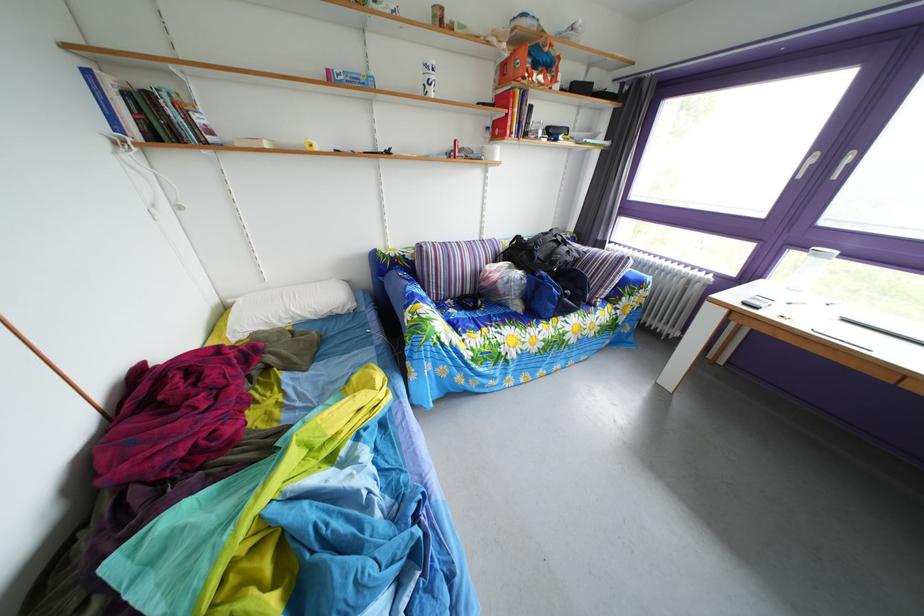
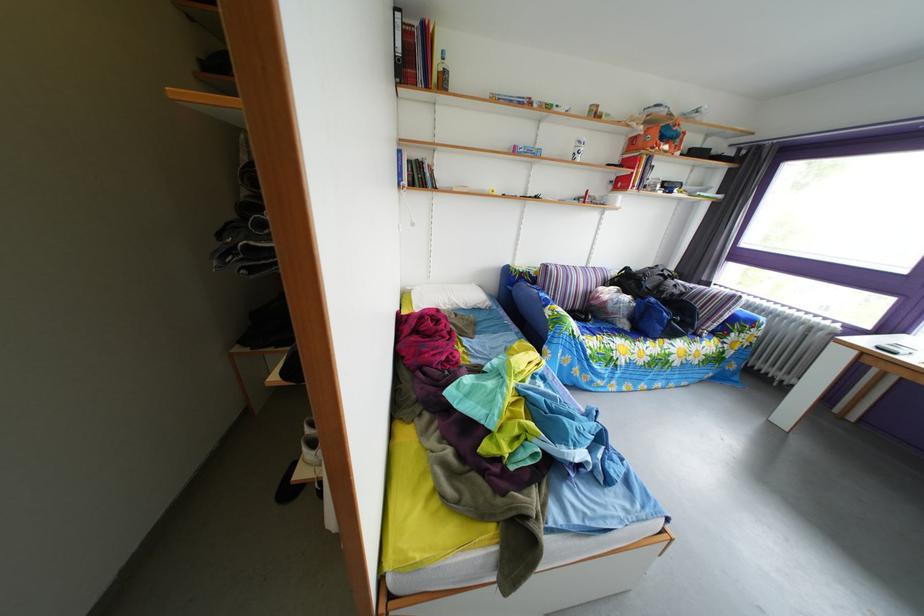
Where in the second image is the point corresponding to (402,277) from the first image?

(529, 289)